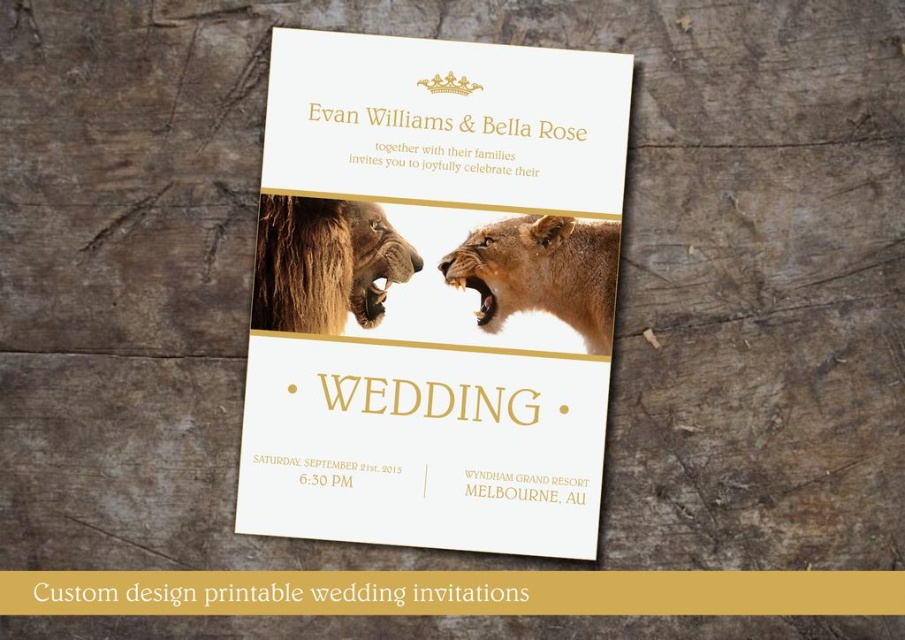
Question: Which of the following is the farthest from the observer?

Choices:
 (A) gold metallic crown at upper center
 (B) golden fur lion at center
 (C) golden textured lion at center

Answer: (A)

Question: Can you confirm if gold paper wedding invitation at center is thinner than golden textured lion at center?

Choices:
 (A) yes
 (B) no

Answer: (B)

Question: Is gold paper wedding invitation at center positioned in front of gold paper invitation at upper center?

Choices:
 (A) no
 (B) yes

Answer: (B)

Question: Among these points, which one is farthest from the camera?

Choices:
 (A) (478, 88)
 (B) (274, 256)

Answer: (A)

Question: Is golden textured lion at center to the left of golden fur lion at center from the viewer's perspective?

Choices:
 (A) no
 (B) yes

Answer: (B)

Question: Which object is closer to the camera taking this photo?

Choices:
 (A) gold paper invitation at upper center
 (B) gold paper wedding invitation at center

Answer: (B)